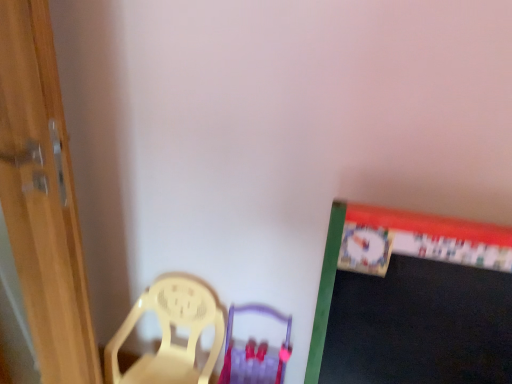
Question: Is yellow plastic chair at lower left smaller than purple plastic armchair at center?

Choices:
 (A) no
 (B) yes

Answer: (A)

Question: Is yellow plastic chair at lower left far away from purple plastic armchair at center?

Choices:
 (A) yes
 (B) no

Answer: (B)

Question: Does yellow plastic chair at lower left have a greater width compared to purple plastic armchair at center?

Choices:
 (A) yes
 (B) no

Answer: (B)

Question: Is yellow plastic chair at lower left facing away from purple plastic armchair at center?

Choices:
 (A) no
 (B) yes

Answer: (A)

Question: From a real-world perspective, is yellow plastic chair at lower left physically below purple plastic armchair at center?

Choices:
 (A) no
 (B) yes

Answer: (A)

Question: Considering the positions of wooden door at left and yellow plastic chair at lower left in the image, is wooden door at left bigger or smaller than yellow plastic chair at lower left?

Choices:
 (A) big
 (B) small

Answer: (A)

Question: Do you think wooden door at left is within yellow plastic chair at lower left, or outside of it?

Choices:
 (A) inside
 (B) outside

Answer: (B)

Question: Does point pos(80,263) appear closer or farther from the camera than point pos(155,284)?

Choices:
 (A) farther
 (B) closer

Answer: (B)

Question: Considering the positions of wooden door at left and yellow plastic chair at lower left in the image, is wooden door at left wider or thinner than yellow plastic chair at lower left?

Choices:
 (A) thin
 (B) wide

Answer: (A)

Question: Choose the correct answer: Is wooden door at left inside purple plastic armchair at center or outside it?

Choices:
 (A) inside
 (B) outside

Answer: (B)

Question: Looking at their shapes, would you say wooden door at left is wider or thinner than purple plastic armchair at center?

Choices:
 (A) wide
 (B) thin

Answer: (B)

Question: Does point (48, 253) appear closer or farther from the camera than point (229, 324)?

Choices:
 (A) closer
 (B) farther

Answer: (A)

Question: From a real-world perspective, relative to purple plastic armchair at center, is wooden door at left vertically above or below?

Choices:
 (A) above
 (B) below

Answer: (A)

Question: Looking at the image, does purple plastic armchair at center seem bigger or smaller compared to wooden door at left?

Choices:
 (A) small
 (B) big

Answer: (A)

Question: Is purple plastic armchair at center wider or thinner than wooden door at left?

Choices:
 (A) wide
 (B) thin

Answer: (A)